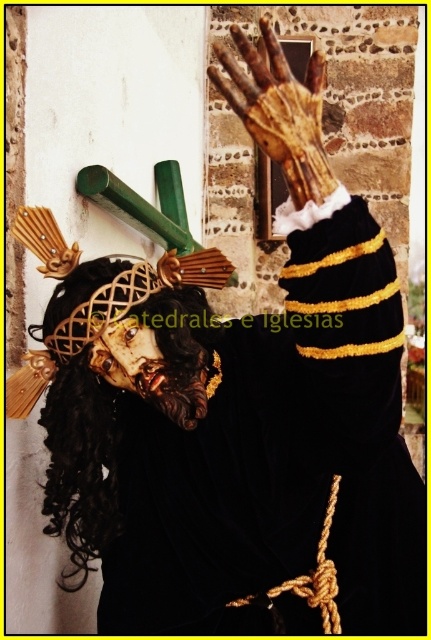
Which of these two, black curly wig at left or wooden hand at upper center, stands shorter?

wooden hand at upper center

Is black curly wig at left below wooden hand at upper center?

Indeed, black curly wig at left is positioned under wooden hand at upper center.

Is point (49, 476) less distant than point (278, 51)?

No, it is not.

Locate an element on the screen. This screenshot has height=640, width=431. black curly wig at left is located at coordinates click(x=119, y=410).